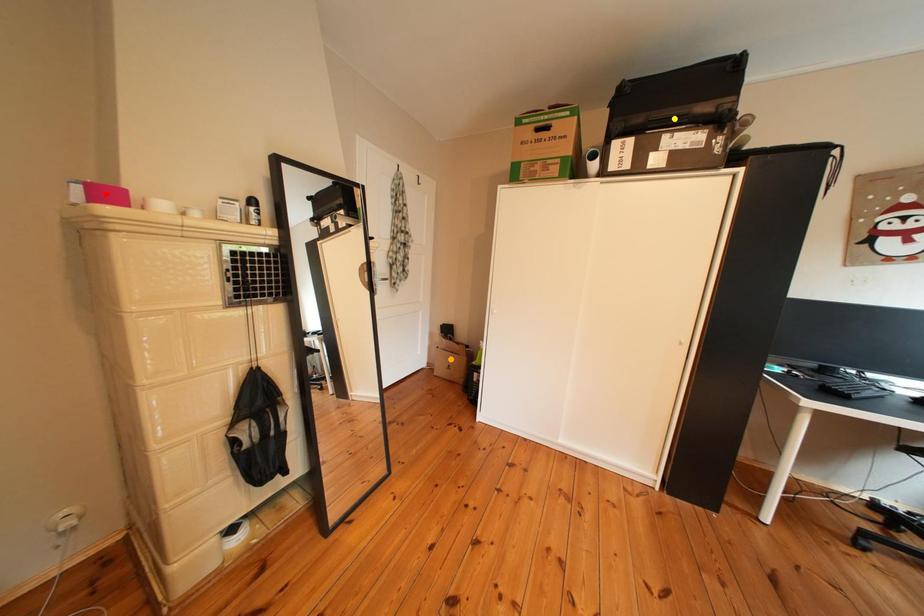
Order these from nearest to farthest:
A) red point
B) yellow point
C) orange point

1. red point
2. yellow point
3. orange point